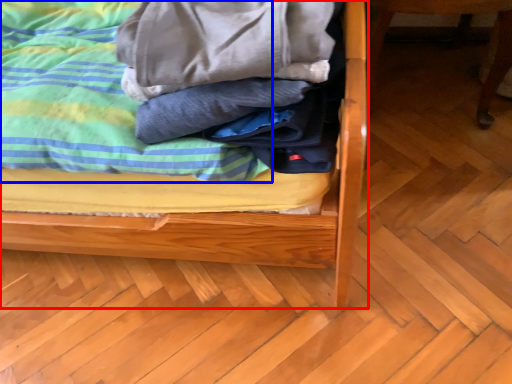
Question: Which object is further to the camera taking this photo, bed (highlighted by a red box) or blanket (highlighted by a blue box)?

Choices:
 (A) bed
 (B) blanket

Answer: (B)